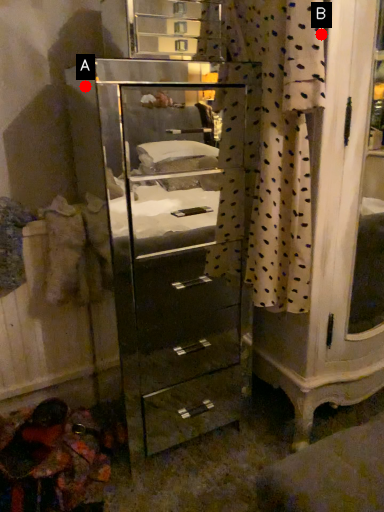
Question: Two points are circled on the image, labeled by A and B beside each circle. Which point is farther to the camera?

Choices:
 (A) A is further
 (B) B is further

Answer: (A)